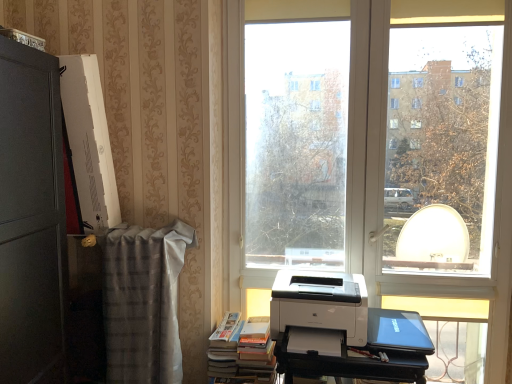
Question: Is the position of transparent glass window at center more distant than that of matte black laptop at lower right?

Choices:
 (A) no
 (B) yes

Answer: (B)

Question: Can you confirm if transparent glass window at center is thinner than matte black laptop at lower right?

Choices:
 (A) yes
 (B) no

Answer: (A)

Question: Is transparent glass window at center oriented away from matte black laptop at lower right?

Choices:
 (A) no
 (B) yes

Answer: (A)

Question: Is transparent glass window at center surrounding matte black laptop at lower right?

Choices:
 (A) no
 (B) yes

Answer: (A)

Question: From a real-world perspective, is transparent glass window at center under matte black laptop at lower right?

Choices:
 (A) no
 (B) yes

Answer: (A)

Question: From a real-world perspective, is transparent glass window at center located higher than matte black laptop at lower right?

Choices:
 (A) no
 (B) yes

Answer: (B)

Question: Does plaid fabric at left have a greater width compared to transparent glass window at center?

Choices:
 (A) yes
 (B) no

Answer: (A)

Question: Can you confirm if plaid fabric at left is positioned to the right of transparent glass window at center?

Choices:
 (A) no
 (B) yes

Answer: (A)

Question: Does plaid fabric at left turn towards transparent glass window at center?

Choices:
 (A) no
 (B) yes

Answer: (A)

Question: Considering the relative sizes of plaid fabric at left and transparent glass window at center in the image provided, is plaid fabric at left smaller than transparent glass window at center?

Choices:
 (A) yes
 (B) no

Answer: (A)

Question: Considering the relative positions of plaid fabric at left and transparent glass window at center in the image provided, is plaid fabric at left behind transparent glass window at center?

Choices:
 (A) yes
 (B) no

Answer: (B)

Question: Does plaid fabric at left have a larger size compared to transparent glass window at center?

Choices:
 (A) no
 (B) yes

Answer: (A)

Question: From a real-world perspective, is transparent glass window at center located beneath black plastic printer at lower right?

Choices:
 (A) yes
 (B) no

Answer: (B)